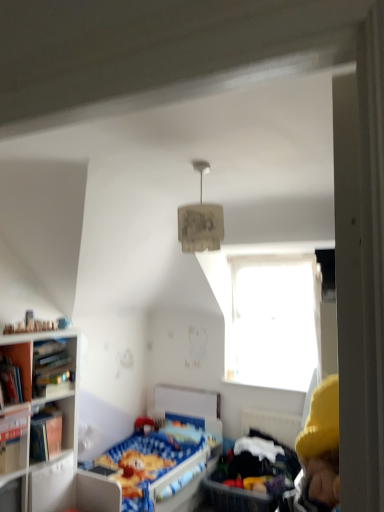
Describe the element at coordinates (41, 421) in the screenshot. I see `wooden bookshelf at left` at that location.

This screenshot has width=384, height=512. Describe the element at coordinates (200, 221) in the screenshot. I see `matte beige lampshade at center` at that location.

What do you see at coordinates (273, 321) in the screenshot?
I see `transparent glass window at upper center` at bounding box center [273, 321].

Image resolution: width=384 pixels, height=512 pixels. What do you see at coordinates (249, 476) in the screenshot?
I see `blue fabric infant bed at lower right` at bounding box center [249, 476].

At what (x,y) coordinates should I click in order to perform the action: click on wooden bookshelf at left. Please return your answer as a coordinate pair (x, y). The image size is (384, 512). Looking at the image, I should click on (41, 421).

Is hardcover book at left, which is the 1th book from bottom to top, facing towards matte beige lampshade at center?

No, hardcover book at left, which is the 1th book from bottom to top, is not aimed at matte beige lampshade at center.

From the image's perspective, starting from the matte beige lampshade at center, which book is the 2nd one below? Please provide its 2D coordinates.

[(14, 440)]

Is hardcover book at left, placed as the second book when sorted from top to bottom, inside or outside of matte beige lampshade at center?

hardcover book at left, placed as the second book when sorted from top to bottom, is not inside matte beige lampshade at center, it's outside.

Could you tell me if wooden bookshelf at left is facing matte beige lampshade at center?

No.

Is wooden bookshelf at left directly adjacent to matte beige lampshade at center?

No, wooden bookshelf at left is not in contact with matte beige lampshade at center.

In the scene shown: From their relative heights in the image, would you say wooden bookshelf at left is taller or shorter than matte beige lampshade at center?

Clearly, wooden bookshelf at left is shorter compared to matte beige lampshade at center.

Is point (2, 342) closer or farther from the camera than point (215, 226)?

Point (2, 342) is positioned farther from the camera compared to point (215, 226).

Choose the correct answer: Is wooden bookshelf at left inside blue fabric bed at center or outside it?

wooden bookshelf at left is spatially situated outside blue fabric bed at center.

From the image's perspective, between wooden bookshelf at left and blue fabric bed at center, who is located below?

From the image's view, blue fabric bed at center is below.

Would you consider wooden bookshelf at left to be distant from blue fabric bed at center?

Yes, wooden bookshelf at left and blue fabric bed at center are located far from each other.

Is blue fabric bed at center at the back of wooden bookshelf at left?

No, blue fabric bed at center is not at the back of wooden bookshelf at left.

Is blue fabric bed at center turned away from wooden bookshelf at left?

blue fabric bed at center is not turned away from wooden bookshelf at left.

Relative to wooden bookshelf at left, is blue fabric bed at center in front or behind?

blue fabric bed at center is behind wooden bookshelf at left.

In the scene shown: Which is more to the right, blue fabric bed at center or wooden bookshelf at left?

From the viewer's perspective, blue fabric bed at center appears more on the right side.

Looking at this image, from the image's perspective, is blue fabric bed at center located above or below wooden bookshelf at left?

Based on their image positions, blue fabric bed at center is located beneath wooden bookshelf at left.

Are wooden bookshelf at left and hardcover book at left, which is the 1th book from bottom to top, located far from each other?

No, wooden bookshelf at left is in close proximity to hardcover book at left, which is the 1th book from bottom to top.

From a real-world perspective, starting from the wooden bookshelf at left, which book is the 1st one vertically above it? Please provide its 2D coordinates.

[(14, 440)]

Does wooden bookshelf at left turn towards hardcover book at left, which is the 1th book from bottom to top?

Yes, wooden bookshelf at left faces towards hardcover book at left, which is the 1th book from bottom to top.

Based on their sizes in the image, would you say wooden bookshelf at left is bigger or smaller than hardcover book at left, placed as the second book when sorted from top to bottom?

Clearly, wooden bookshelf at left is larger in size than hardcover book at left, placed as the second book when sorted from top to bottom.

From a real-world perspective, is wooden bookshelf at left located beneath wooden bookshelf at left?

Indeed, from a real-world perspective, wooden bookshelf at left is positioned beneath wooden bookshelf at left.

Is wooden bookshelf at left at the back of wooden bookshelf at left?

Yes, wooden bookshelf at left is at the back of wooden bookshelf at left.

What's the angular difference between wooden bookshelf at left and wooden bookshelf at left's facing directions?

The angle between the facing direction of wooden bookshelf at left and the facing direction of wooden bookshelf at left is 2.14 degrees.

Which object is further away from the camera, wooden bookshelf at left or wooden bookshelf at left?

Positioned behind is wooden bookshelf at left.

Is wooden bookshelf at left wider than transparent glass window at upper center?

Indeed, wooden bookshelf at left has a greater width compared to transparent glass window at upper center.

In the scene shown: Is wooden bookshelf at left in contact with transparent glass window at upper center?

No, wooden bookshelf at left is not with transparent glass window at upper center.

Is wooden bookshelf at left turned away from transparent glass window at upper center?

No.

Considering the sizes of wooden bookshelf at left and transparent glass window at upper center in the image, is wooden bookshelf at left taller or shorter than transparent glass window at upper center?

wooden bookshelf at left is shorter than transparent glass window at upper center.

Locate an element on the screen. light fixture above the hardcover book at left, placed as the second book when sorted from top to bottom (from a real-world perspective) is located at coordinates (200, 221).

The width and height of the screenshot is (384, 512). Identify the location of light fixture to the right of wooden bookshelf at left. (200, 221).

From the image, which object appears to be farther from blue fabric bed at center, hardcover book at left, which is the 1th book from bottom to top, or matte beige lampshade at center?

matte beige lampshade at center is positioned further to the anchor blue fabric bed at center.

Based on their spatial positions, is wooden bookshelf at left or hardcover book at left, which is the 1th book from bottom to top, further from blue fabric bed at center?

hardcover book at left, which is the 1th book from bottom to top.

Based on their spatial positions, is wooden bookshelf at left or hardcover book at left, acting as the 2th book starting from the bottom, further from matte beige lampshade at center?

The object further to matte beige lampshade at center is hardcover book at left, acting as the 2th book starting from the bottom.

When comparing their distances from transparent glass window at upper center, does matte beige lampshade at center or hardcover book at left, placed as the second book when sorted from top to bottom, seem further?

hardcover book at left, placed as the second book when sorted from top to bottom.

Based on their spatial positions, is blue fabric infant bed at lower right or blue fabric bed at center further from hardcover book at left, which is the 1th book from bottom to top?

The object further to hardcover book at left, which is the 1th book from bottom to top, is blue fabric infant bed at lower right.

When comparing their distances from matte beige lampshade at center, does blue fabric infant bed at lower right or hardcover book at left, acting as the 2th book starting from the bottom, seem further?

Based on the image, blue fabric infant bed at lower right appears to be further to matte beige lampshade at center.

Which object lies nearer to the anchor point blue fabric infant bed at lower right, transparent glass window at upper center or hardcover book at left, the 1th book viewed from the top?

transparent glass window at upper center lies closer to blue fabric infant bed at lower right than the other object.

Looking at the image, which one is located closer to wooden bookshelf at left, blue fabric bed at center or hardcover book at left, placed as the second book when sorted from top to bottom?

hardcover book at left, placed as the second book when sorted from top to bottom, is closer to wooden bookshelf at left.

The height and width of the screenshot is (512, 384). In order to click on shelf between matte beige lampshade at center and blue fabric bed at center from top to bottom in this screenshot , I will do `click(44, 361)`.

You are a GUI agent. You are given a task and a screenshot of the screen. Output one action in this format:
    pyautogui.click(x=<x>, y=<y>)
    Task: Click on the shelf between hardcover book at left, the 1th book viewed from the top, and matte beige lampshade at center, in the horizontal direction
    This screenshot has width=384, height=512.
    Given the screenshot: What is the action you would take?
    pyautogui.click(x=44, y=361)

The image size is (384, 512). I want to click on bed located between hardcover book at left, which is the 1th book from bottom to top, and blue fabric infant bed at lower right in the left-right direction, so click(x=168, y=453).

Where is `shelf between matte beige lampshade at center and wooden bookshelf at left vertically`? shelf between matte beige lampshade at center and wooden bookshelf at left vertically is located at coordinates (44, 361).